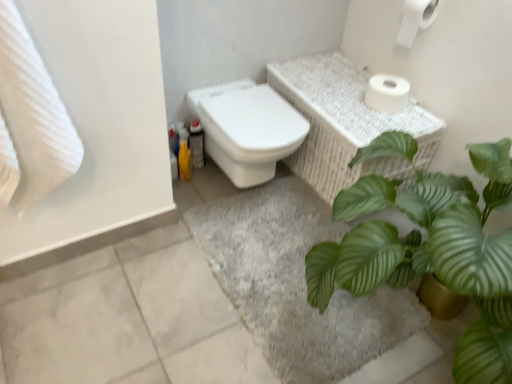
Locate an element on the screen. vacant space situated on the left part of white matte toilet paper at upper right, which is counted as the 1th toilet paper, starting from the bottom is located at coordinates (343, 100).